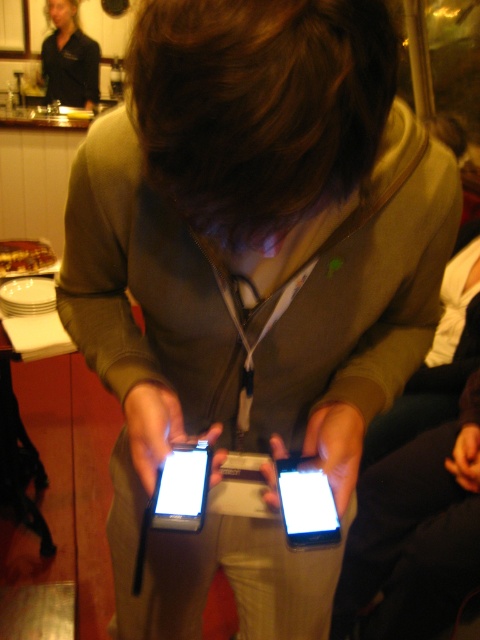
Based on the photo, which is more to the left, matte black smartphone at center or black glossy smartphone at center?

Positioned to the left is black glossy smartphone at center.

Based on the photo, between matte black smartphone at center and black glossy smartphone at center, which one appears on the right side from the viewer's perspective?

From the viewer's perspective, matte black smartphone at center appears more on the right side.

Does point (324, 522) come closer to viewer compared to point (171, 461)?

Yes, point (324, 522) is in front of point (171, 461).

I want to click on matte black smartphone at center, so click(x=305, y=502).

Is point (55, 88) more distant than point (307, 520)?

Yes, point (55, 88) is behind point (307, 520).

I want to click on black shirt at upper left, so click(69, 58).

Between point (55, 10) and point (200, 474), which one is positioned behind?

Positioned behind is point (55, 10).

Is black shirt at upper left bigger than black glossy smartphone at center?

Yes, black shirt at upper left is bigger than black glossy smartphone at center.

The image size is (480, 640). What are the coordinates of `black shirt at upper left` in the screenshot? It's located at (69, 58).